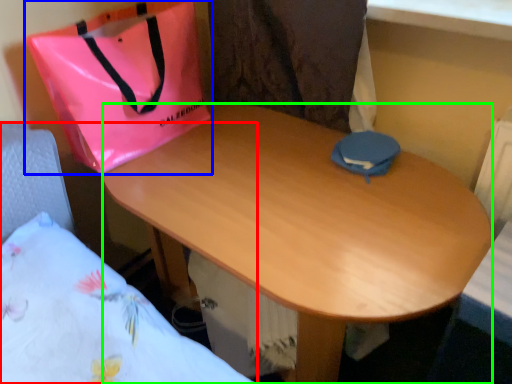
Question: Estimate the real-world distances between objects in this image. Which object is closer to bed (highlighted by a red box), handbag (highlighted by a blue box) or desk (highlighted by a green box)?

Choices:
 (A) handbag
 (B) desk

Answer: (A)